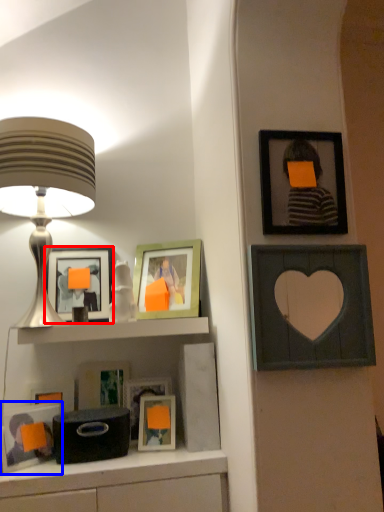
Question: Which object is closer to the camera taking this photo, picture frame (highlighted by a red box) or picture frame (highlighted by a blue box)?

Choices:
 (A) picture frame
 (B) picture frame

Answer: (B)